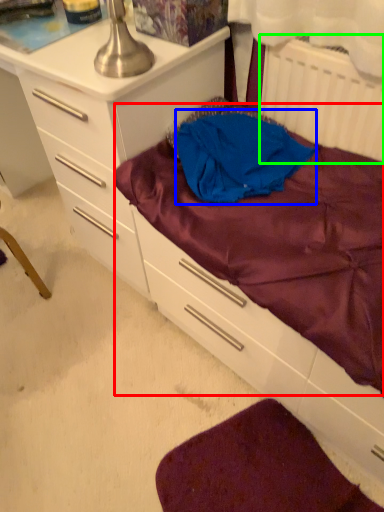
Question: Which object is positioned farthest from mattress (highlighted by a red box)? Select from clothing (highlighted by a blue box) and radiator (highlighted by a green box).

Choices:
 (A) clothing
 (B) radiator

Answer: (B)